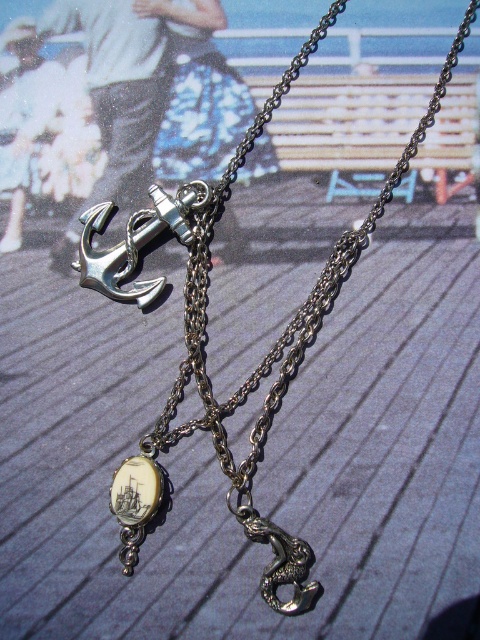
Question: Is silver metallic anchor at upper left above ivory/shell-like ship at center?

Choices:
 (A) yes
 (B) no

Answer: (A)

Question: Among these objects, which one is nearest to the camera?

Choices:
 (A) ivory/shell-like ship at center
 (B) antique silver anchor at center

Answer: (B)

Question: Estimate the real-world distances between objects in this image. Which object is closer to the ivory/shell-like ship at center?

Choices:
 (A) silver metallic anchor at upper left
 (B) antique silver anchor at center

Answer: (B)

Question: Which point is farther to the camera?

Choices:
 (A) (128, 477)
 (B) (119, 298)
 (C) (297, 605)

Answer: (B)

Question: Does silver metallic anchor at upper left appear over ivory/shell-like ship at center?

Choices:
 (A) no
 (B) yes

Answer: (B)

Question: Observing the image, what is the correct spatial positioning of antique silver anchor at center in reference to ivory/shell-like ship at center?

Choices:
 (A) above
 (B) below

Answer: (A)